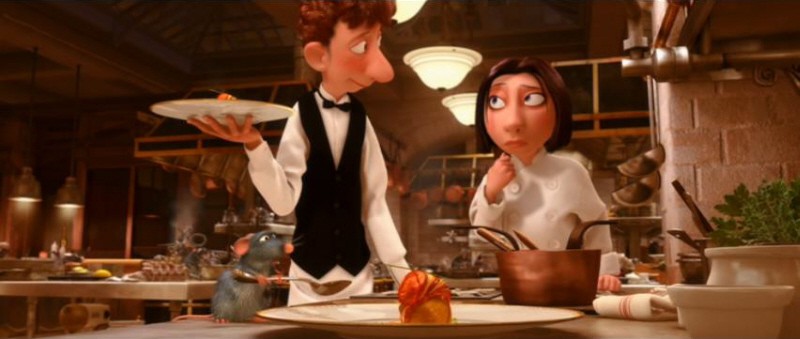
Locate an element on the screen. bulb is located at coordinates pyautogui.click(x=456, y=66).